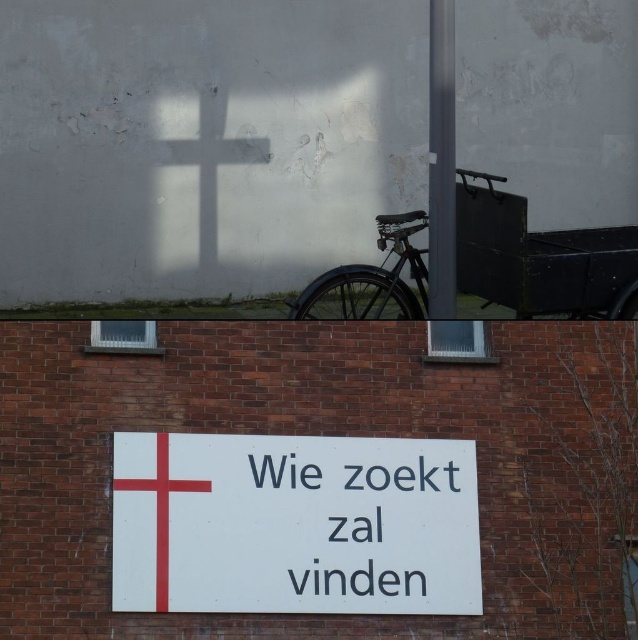
Question: Can you confirm if white matte sign at center is smaller than matte black bicycle at center?

Choices:
 (A) no
 (B) yes

Answer: (A)

Question: Does white matte sign at center appear on the left side of red painted wooden cross at center?

Choices:
 (A) yes
 (B) no

Answer: (B)

Question: Does white paper sign at center come in front of matte black bicycle at center?

Choices:
 (A) no
 (B) yes

Answer: (A)

Question: Which of the following is the closest to the observer?

Choices:
 (A) red painted wooden cross at center
 (B) matte black bicycle at center
 (C) metallic pole at upper right

Answer: (C)

Question: Which of the following is the farthest from the observer?

Choices:
 (A) white matte sign at center
 (B) white paper sign at center
 (C) metallic pole at upper right

Answer: (B)

Question: Considering the real-world distances, which object is farthest from the white paper sign at center?

Choices:
 (A) red painted wooden cross at center
 (B) matte black bicycle at center
 (C) white matte sign at center

Answer: (B)